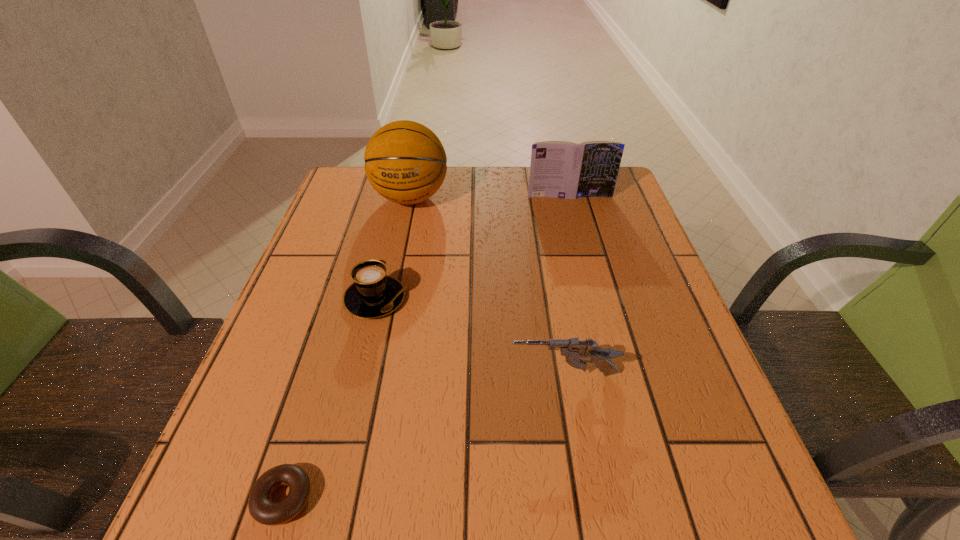
Find the location of a particular element. doughnut that is at the left edge is located at coordinates (261, 507).

I want to click on book located at the right edge, so click(x=560, y=169).

Find the location of a particular element. gun at the right edge is located at coordinates (574, 350).

The image size is (960, 540). In order to click on object that is at the far left corner in this screenshot , I will do `click(405, 162)`.

Where is `object located at the near left corner`? This screenshot has width=960, height=540. object located at the near left corner is located at coordinates (261, 507).

At what (x,y) coordinates should I click in order to perform the action: click on object that is positioned at the far right corner. Please return your answer as a coordinate pair (x, y). Looking at the image, I should click on (560, 169).

In the image, there is a desktop. Identify the location of free space at the far edge. (441, 199).

In the image, there is a desktop. Where is `free space at the near edge`? Image resolution: width=960 pixels, height=540 pixels. free space at the near edge is located at coordinates (366, 515).

The image size is (960, 540). Find the location of `free space at the left edge`. free space at the left edge is located at coordinates (357, 237).

Image resolution: width=960 pixels, height=540 pixels. I want to click on free space at the right edge, so click(656, 294).